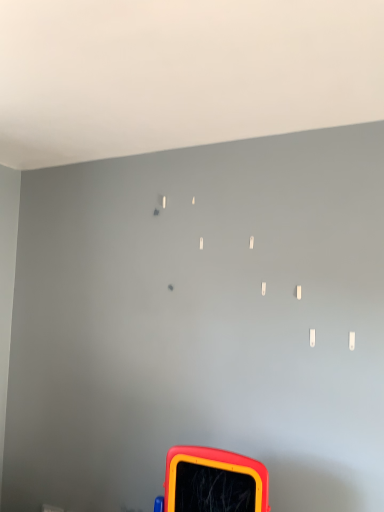
This screenshot has height=512, width=384. What are the coordinates of `rubberized plastic chalkboard at lower center` in the screenshot? It's located at (213, 482).

The image size is (384, 512). Describe the element at coordinates (213, 482) in the screenshot. I see `rubberized plastic chalkboard at lower center` at that location.

Where is `rubberized plastic chalkboard at lower center`? rubberized plastic chalkboard at lower center is located at coordinates (x=213, y=482).